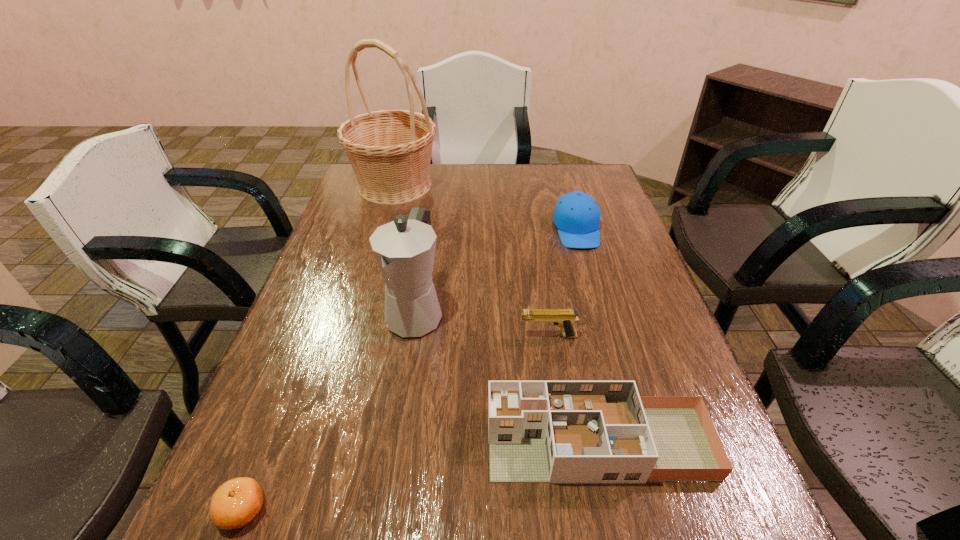
You are a GUI agent. You are given a task and a screenshot of the screen. Output one action in this format:
    pyautogui.click(x=<x>, y=<y>)
    Task: Click on the vacant space located 0.120m on the front-facing side of the second farthest object
    The height and width of the screenshot is (540, 960).
    Given the screenshot: What is the action you would take?
    pyautogui.click(x=590, y=278)

Where is `vacant space positioned at the front door of the second nearest object`? This screenshot has height=540, width=960. vacant space positioned at the front door of the second nearest object is located at coordinates (275, 443).

Identify the location of vacant space located 0.250m at the front door of the second nearest object. (355, 443).

Image resolution: width=960 pixels, height=540 pixels. In order to click on free space located 0.230m at the front door of the second nearest object in this screenshot , I will do `click(366, 443)`.

This screenshot has height=540, width=960. Identify the location of vacant point located 0.180m at the barrel of the pistol. (443, 336).

The height and width of the screenshot is (540, 960). In order to click on free space located at the barrel of the pistol in this screenshot , I will do `click(455, 336)`.

Find the location of a particular element. blank space located at the barrel of the pistol is located at coordinates (472, 336).

Identify the location of free point located 0.380m on the back of the clementine. (314, 326).

Where is `object that is at the far edge`? Image resolution: width=960 pixels, height=540 pixels. object that is at the far edge is located at coordinates (390, 151).

Locate an element on the screen. The image size is (960, 540). object that is at the near edge is located at coordinates (235, 503).